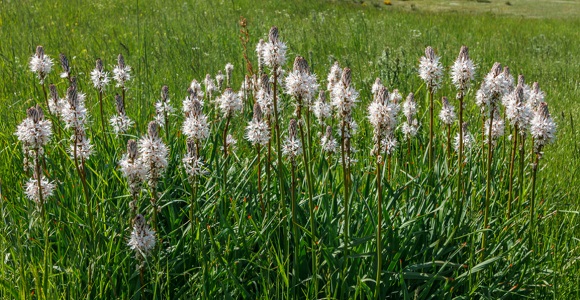
Find the location of `brown dried flower top`. brown dried flower top is located at coordinates (245, 49).